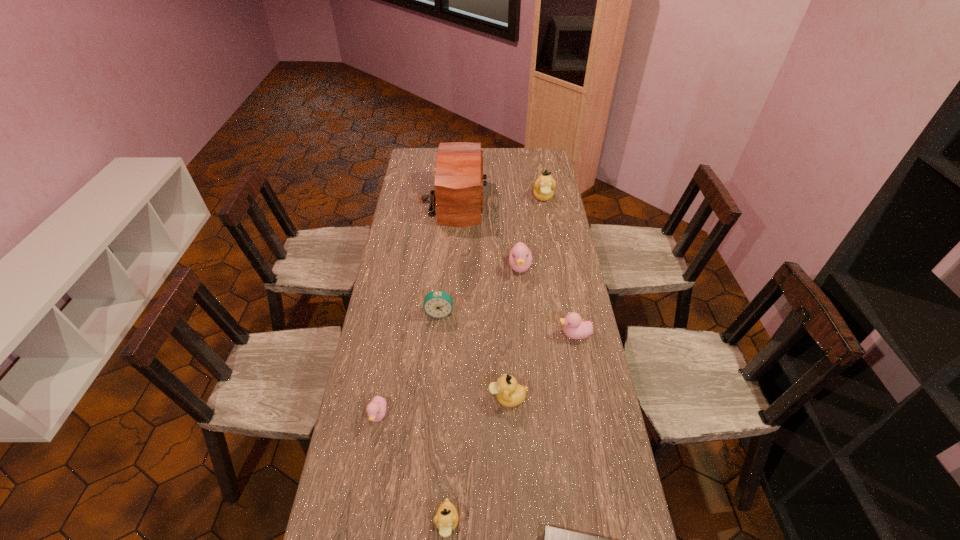
At what (x,y) coordinates should I click in order to perform the action: click on the third farthest duckling. Please return your answer as a coordinate pair (x, y). The height and width of the screenshot is (540, 960). Looking at the image, I should click on (575, 328).

The width and height of the screenshot is (960, 540). Identify the location of the second shortest object. click(x=376, y=409).

I want to click on the nearest pink duckling, so click(x=376, y=409).

Locate an element on the screen. The image size is (960, 540). vacant space situated on the front-facing side of the radio receiver is located at coordinates (524, 201).

What are the coordinates of `free space located on the face of the farthest tan duckling` in the screenshot? It's located at (554, 261).

Locate an element on the screen. vacant space located on the front-facing side of the biggest pink duckling is located at coordinates point(529,366).

Identify the location of free space located on the face of the second biggest tan duckling. (437, 398).

Where is `free space located 0.180m on the face of the second biggest tan duckling`? free space located 0.180m on the face of the second biggest tan duckling is located at coordinates (431, 398).

Find the location of `vacant space located on the face of the second biggest tan duckling`. vacant space located on the face of the second biggest tan duckling is located at coordinates (434, 398).

Image resolution: width=960 pixels, height=540 pixels. What are the coordinates of `vacant space located 0.170m on the front-facing side of the sixth nearest object` in the screenshot? It's located at (436, 359).